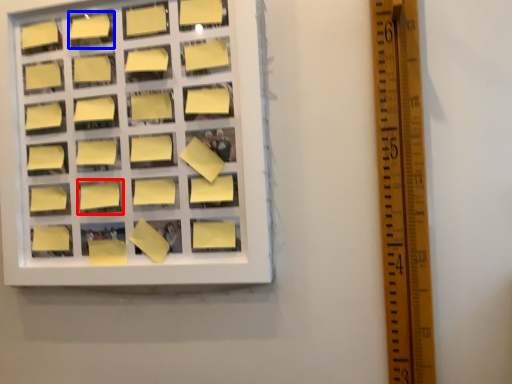
Question: Which point is further to the camera, square (highlighted by a red box) or square (highlighted by a blue box)?

Choices:
 (A) square
 (B) square

Answer: (B)